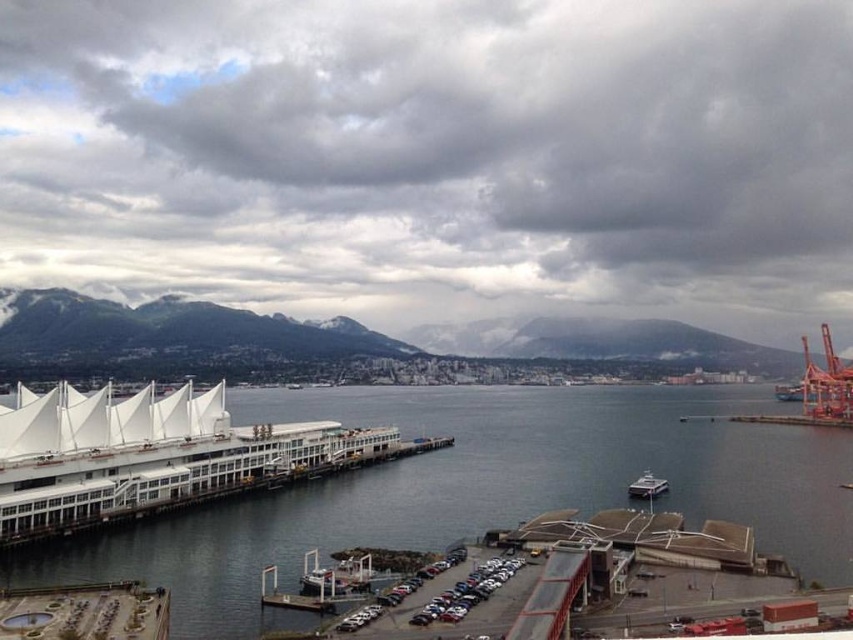
Who is higher up, transparent glass water at center or white glossy boat at center?

white glossy boat at center

Which is in front, point (283, 513) or point (648, 474)?

Point (283, 513) is more forward.

Identify the location of transparent glass water at center. The image size is (853, 640). (480, 488).